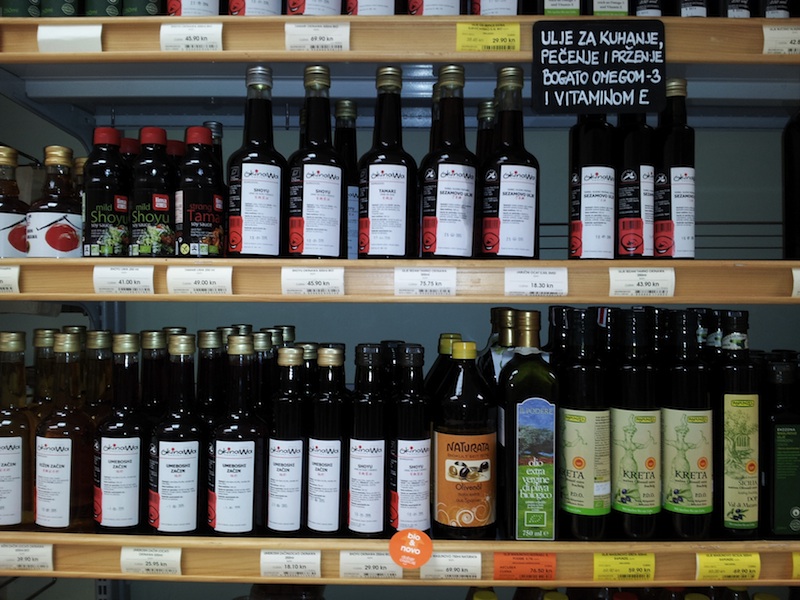
Where is `wall`? wall is located at coordinates (410, 328), (338, 323), (760, 170), (286, 141).